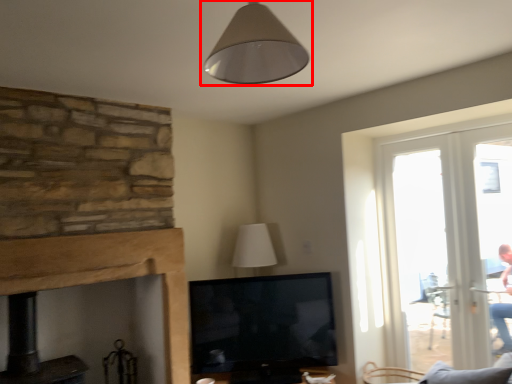
Question: From the image's perspective, considering the relative positions of lamp (annotated by the red box) and fireplace in the image provided, where is lamp (annotated by the red box) located with respect to the staircase?

Choices:
 (A) above
 (B) below

Answer: (A)